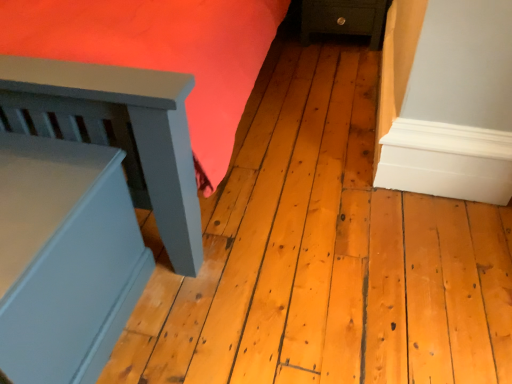
Question: Is dark green wood nightstand at lower right, marked as the second furniture in a bottom-to-top arrangement, positioned in front of matte blue bed frame at left, which appears as the 2th furniture when viewed from the top?

Choices:
 (A) no
 (B) yes

Answer: (A)

Question: Does dark green wood nightstand at lower right, which is the 1th furniture in right-to-left order, have a smaller size compared to matte blue bed frame at left, the second furniture positioned from the right?

Choices:
 (A) yes
 (B) no

Answer: (A)

Question: Is dark green wood nightstand at lower right, which appears as the 2th furniture when viewed from the left, to the left of matte blue bed frame at left, the 2th furniture from the back, from the viewer's perspective?

Choices:
 (A) yes
 (B) no

Answer: (B)

Question: Is dark green wood nightstand at lower right, marked as the second furniture in a bottom-to-top arrangement, to the right of matte blue bed frame at left, which appears as the 2th furniture when viewed from the top, from the viewer's perspective?

Choices:
 (A) yes
 (B) no

Answer: (A)

Question: From a real-world perspective, is dark green wood nightstand at lower right, the 2th furniture positioned from the front, on top of matte blue bed frame at left, the first furniture in the front-to-back sequence?

Choices:
 (A) yes
 (B) no

Answer: (B)

Question: Is dark green wood nightstand at lower right, marked as the second furniture in a bottom-to-top arrangement, further to camera compared to matte blue bed frame at left, the second furniture positioned from the right?

Choices:
 (A) yes
 (B) no

Answer: (A)

Question: From a real-world perspective, is matte blue bed frame at left, which appears as the first furniture when viewed from the left, positioned over dark green wood nightstand at lower right, arranged as the first furniture when viewed from the back, based on gravity?

Choices:
 (A) no
 (B) yes

Answer: (B)

Question: Is matte blue bed frame at left, which appears as the first furniture when viewed from the left, behind dark green wood nightstand at lower right, marked as the second furniture in a bottom-to-top arrangement?

Choices:
 (A) no
 (B) yes

Answer: (A)

Question: Can we say matte blue bed frame at left, which appears as the 2th furniture when viewed from the top, lies outside dark green wood nightstand at lower right, which is the 1th furniture in right-to-left order?

Choices:
 (A) no
 (B) yes

Answer: (B)

Question: From a real-world perspective, is matte blue bed frame at left, the 2th furniture from the back, physically below dark green wood nightstand at lower right, arranged as the first furniture when viewed from the back?

Choices:
 (A) yes
 (B) no

Answer: (B)

Question: From the image's perspective, does matte blue bed frame at left, the 2th furniture from the back, appear lower than dark green wood nightstand at lower right, arranged as the first furniture when viewed from the back?

Choices:
 (A) yes
 (B) no

Answer: (A)

Question: Is matte blue bed frame at left, the 2th furniture from the back, not close to dark green wood nightstand at lower right, which is the 1th furniture in right-to-left order?

Choices:
 (A) yes
 (B) no

Answer: (A)

Question: From a real-world perspective, relative to dark green wood nightstand at lower right, arranged as the first furniture when viewed from the back, is matte blue bed frame at left, the second furniture positioned from the right, vertically above or below?

Choices:
 (A) above
 (B) below

Answer: (A)